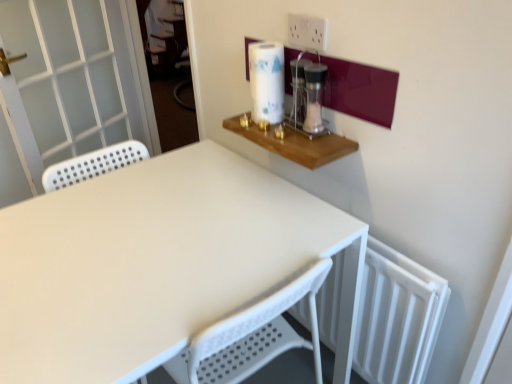
You are a GUI agent. You are given a task and a screenshot of the screen. Output one action in this format:
    pyautogui.click(x=<x>, y=<y>)
    Task: Click on the vacant area that is in front of clear glass salt shaker at upper center
    The width and height of the screenshot is (512, 384).
    Given the screenshot: What is the action you would take?
    [x=305, y=144]